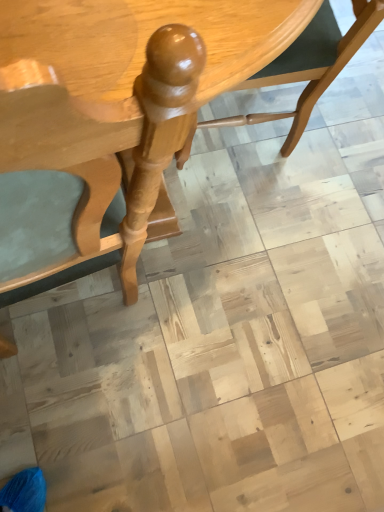
Question: Is glossy wood chair at center shorter than glossy wood table at center?

Choices:
 (A) no
 (B) yes

Answer: (B)

Question: Considering the relative sizes of glossy wood chair at center and glossy wood table at center in the image provided, is glossy wood chair at center bigger than glossy wood table at center?

Choices:
 (A) no
 (B) yes

Answer: (A)

Question: Considering the relative sizes of glossy wood chair at center and glossy wood table at center in the image provided, is glossy wood chair at center wider than glossy wood table at center?

Choices:
 (A) yes
 (B) no

Answer: (B)

Question: Can you confirm if glossy wood chair at center is taller than glossy wood table at center?

Choices:
 (A) yes
 (B) no

Answer: (B)

Question: Is glossy wood chair at center placed right next to glossy wood table at center?

Choices:
 (A) yes
 (B) no

Answer: (B)

Question: From a real-world perspective, is glossy wood chair at center on top of glossy wood table at center?

Choices:
 (A) no
 (B) yes

Answer: (A)

Question: From a real-world perspective, is glossy wood table at center on top of glossy wood chair at center?

Choices:
 (A) no
 (B) yes

Answer: (B)

Question: Would you say glossy wood table at center is outside glossy wood chair at center?

Choices:
 (A) no
 (B) yes

Answer: (B)

Question: Considering the relative sizes of glossy wood table at center and glossy wood chair at center in the image provided, is glossy wood table at center taller than glossy wood chair at center?

Choices:
 (A) no
 (B) yes

Answer: (B)

Question: Considering the relative sizes of glossy wood table at center and glossy wood chair at center in the image provided, is glossy wood table at center thinner than glossy wood chair at center?

Choices:
 (A) yes
 (B) no

Answer: (B)

Question: From a real-world perspective, is glossy wood table at center under glossy wood chair at center?

Choices:
 (A) no
 (B) yes

Answer: (A)

Question: Is glossy wood table at center wider than glossy wood chair at center?

Choices:
 (A) no
 (B) yes

Answer: (B)

Question: Is glossy wood table at center wider or thinner than glossy wood chair at center?

Choices:
 (A) wide
 (B) thin

Answer: (A)